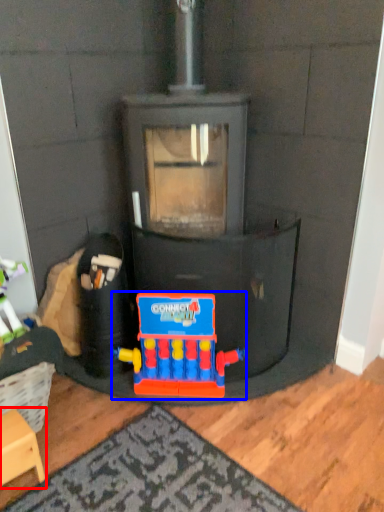
Question: Which object appears farthest to the camera in this image, furniture (highlighted by a red box) or toy (highlighted by a blue box)?

Choices:
 (A) furniture
 (B) toy

Answer: (B)